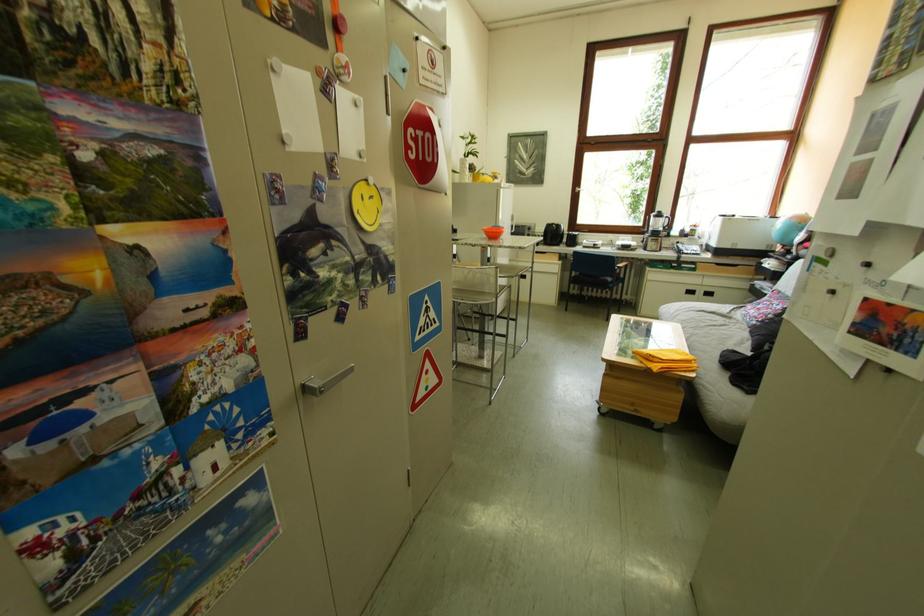
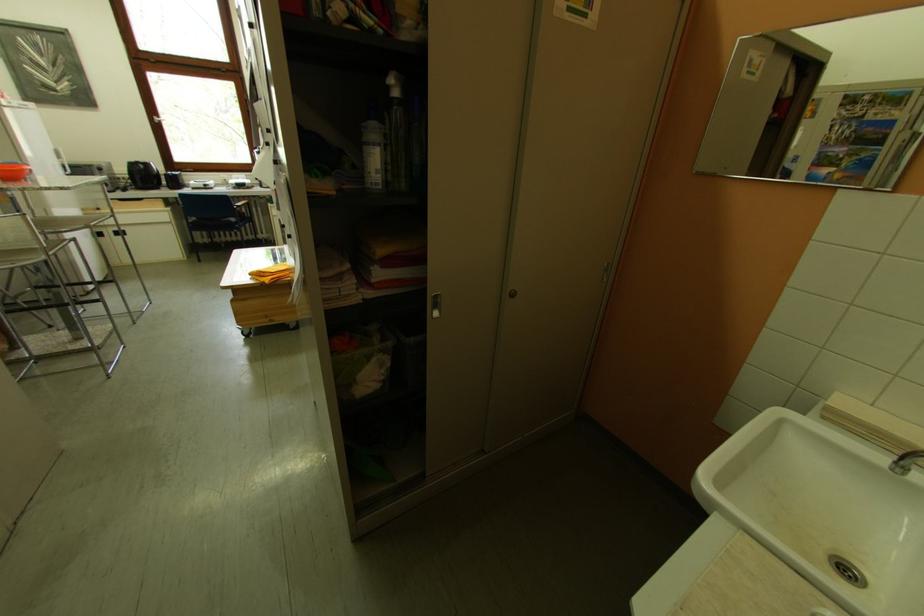
Where in the second image is the point corresponding to point (586, 284) from the first image?

(207, 230)